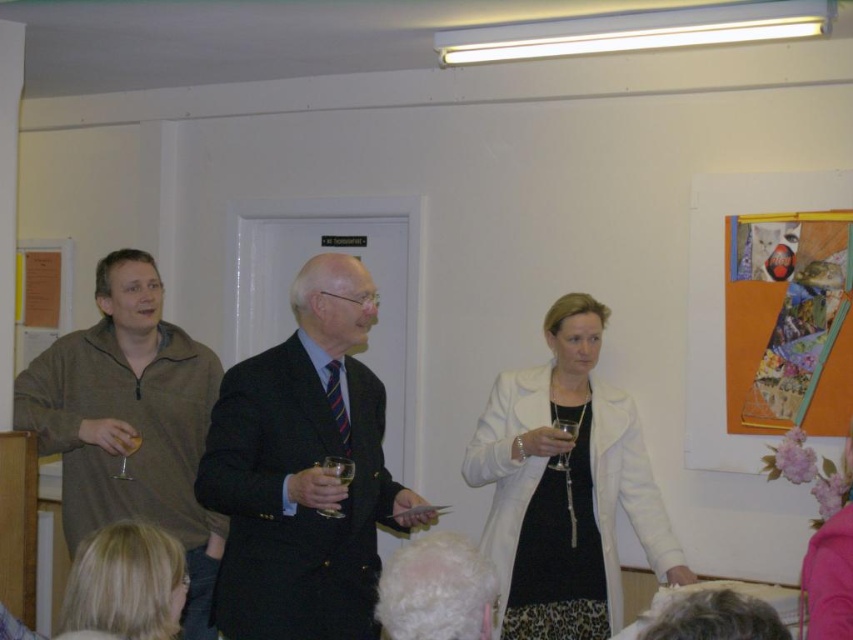
You are at a party and want to know if the white matte coat at center can completely cover the clear glass wine at center. Based on the scene, can it?

The white matte coat at center has a larger size compared to clear glass wine at center, so yes, the white matte coat at center can completely cover the clear glass wine at center.

You are at a party and need to get to the exit, which is behind the dark suit at center and white matte coat at center. Can you walk directly through the space between them?

The dark suit at center is in front of the white matte coat at center, so you can walk directly through the space between them to reach the exit behind.